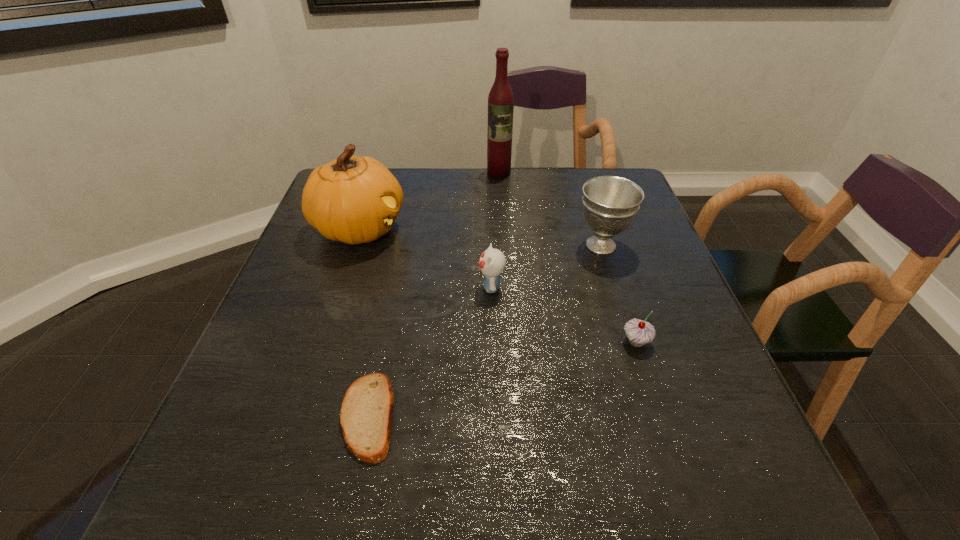
What are the coordinates of `free space that satisfies the following two spatial constraints: 1. on the front face of the fifth shortest object; 2. on the left side of the chalice` in the screenshot? It's located at (354, 245).

Locate an element on the screen. Image resolution: width=960 pixels, height=540 pixels. vacant space that satisfies the following two spatial constraints: 1. on the front face of the pumpkin; 2. on the right side of the fifth tallest object is located at coordinates (323, 342).

Locate an element on the screen. The width and height of the screenshot is (960, 540). free location that satisfies the following two spatial constraints: 1. on the back side of the second nearest object; 2. on the front-facing side of the kitten is located at coordinates (618, 287).

In order to click on free space that satisfies the following two spatial constraints: 1. on the front face of the pita bread; 2. on the left side of the pumpkin in this screenshot , I will do `click(299, 416)`.

Find the location of `free region that satisfies the following two spatial constraints: 1. on the front-facing side of the cupcake; 2. on the left side of the third shortest object`. free region that satisfies the following two spatial constraints: 1. on the front-facing side of the cupcake; 2. on the left side of the third shortest object is located at coordinates (492, 342).

The height and width of the screenshot is (540, 960). I want to click on vacant point that satisfies the following two spatial constraints: 1. on the back side of the fifth tallest object; 2. on the left side of the nearest object, so click(x=383, y=342).